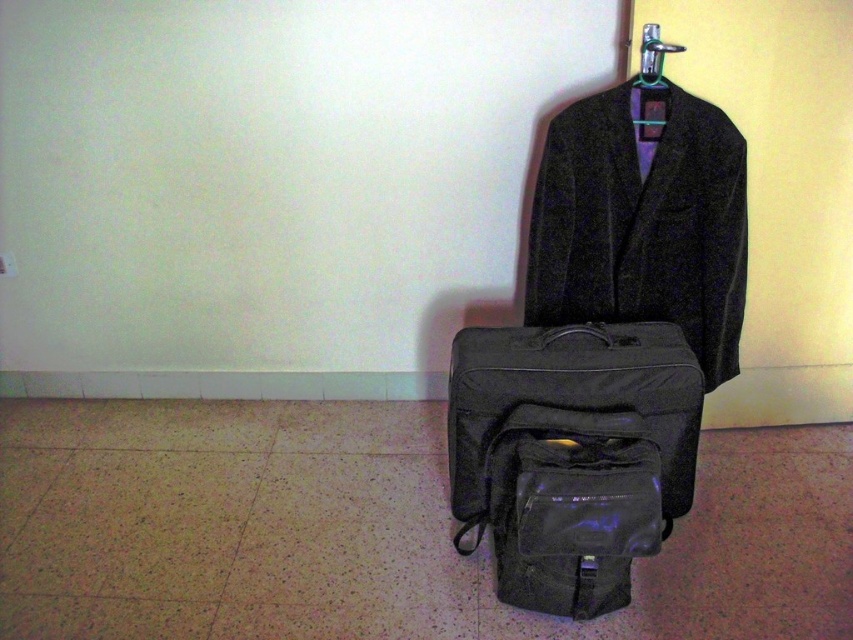
Question: Is black fabric bag at lower center to the left of black fabric suitcase at center from the viewer's perspective?

Choices:
 (A) yes
 (B) no

Answer: (A)

Question: Can you confirm if black fabric bag at lower center is smaller than black fabric suitcase at center?

Choices:
 (A) yes
 (B) no

Answer: (A)

Question: Which of the following is the closest to the observer?

Choices:
 (A) (497, 432)
 (B) (659, 45)
 (C) (631, 378)

Answer: (C)

Question: Which object appears closest to the camera in this image?

Choices:
 (A) velvet black coat at upper center
 (B) metallic silver hanger at upper center
 (C) black fabric bag at lower center
 (D) black fabric suitcase at center

Answer: (C)

Question: Which of the following is the closest to the observer?

Choices:
 (A) (701, 273)
 (B) (526, 380)
 (C) (660, 77)
 (D) (583, 465)

Answer: (D)

Question: Is black fabric bag at lower center closer to the viewer compared to metallic silver hanger at upper center?

Choices:
 (A) no
 (B) yes

Answer: (B)